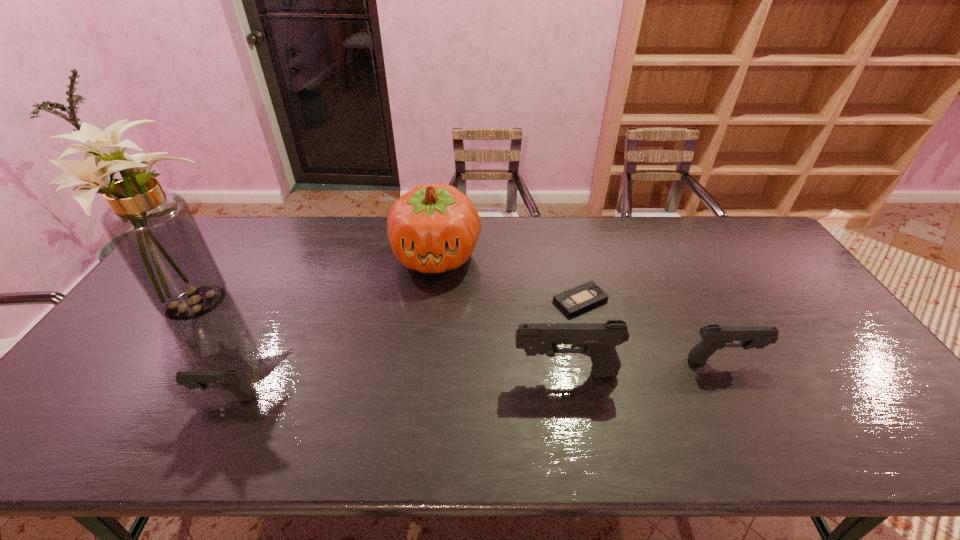
Where is `pistol that is the closest to the rightmost object`? The width and height of the screenshot is (960, 540). pistol that is the closest to the rightmost object is located at coordinates (598, 341).

I want to click on pistol that is the second closest to the second nearest object, so click(x=231, y=380).

Find the location of a particular element. Image resolution: width=960 pixels, height=540 pixels. free location that satisfies the following two spatial constraints: 1. on the front side of the videotape; 2. at the barrel of the leftmost pistol is located at coordinates (604, 398).